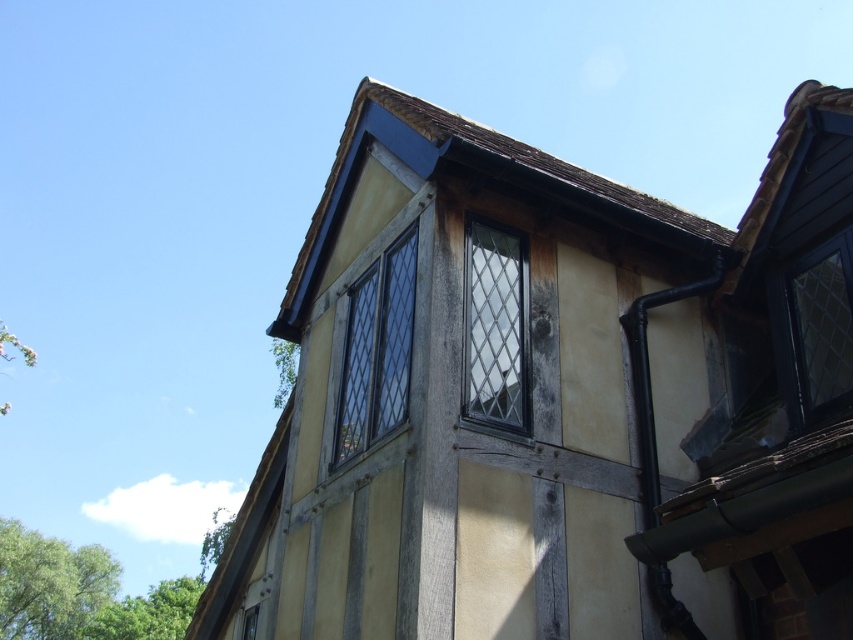
Is point (368, 413) closer to viewer compared to point (512, 333)?

No, it is behind (512, 333).

Is clear glass window at upper center to the right of matte black window at center from the viewer's perspective?

No, clear glass window at upper center is not to the right of matte black window at center.

Describe the element at coordinates (376, 348) in the screenshot. I see `clear glass window at upper center` at that location.

You are a GUI agent. You are given a task and a screenshot of the screen. Output one action in this format:
    pyautogui.click(x=<x>, y=<y>)
    Task: Click on the clear glass window at upper center
    
    Given the screenshot: What is the action you would take?
    pyautogui.click(x=376, y=348)